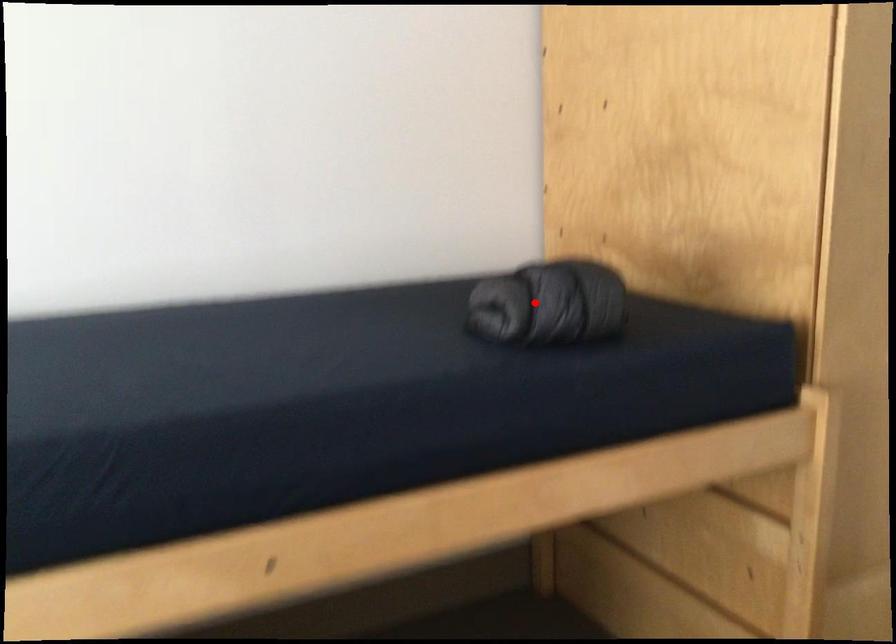
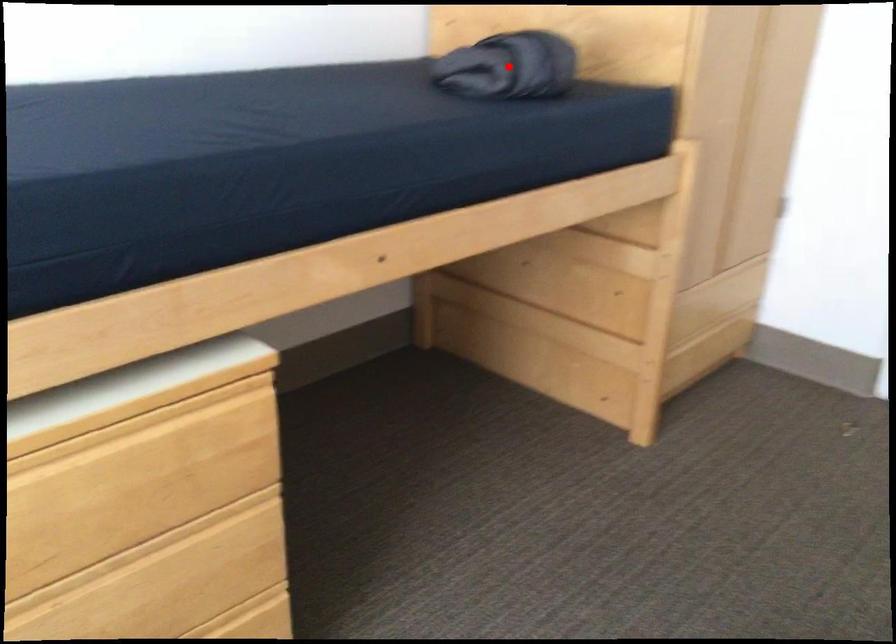
I am providing you with two images of the same scene from different viewpoints. A red point is marked on the first image and another point is marked on the second image. Do the highlighted points in image1 and image2 indicate the same real-world spot?

Yes